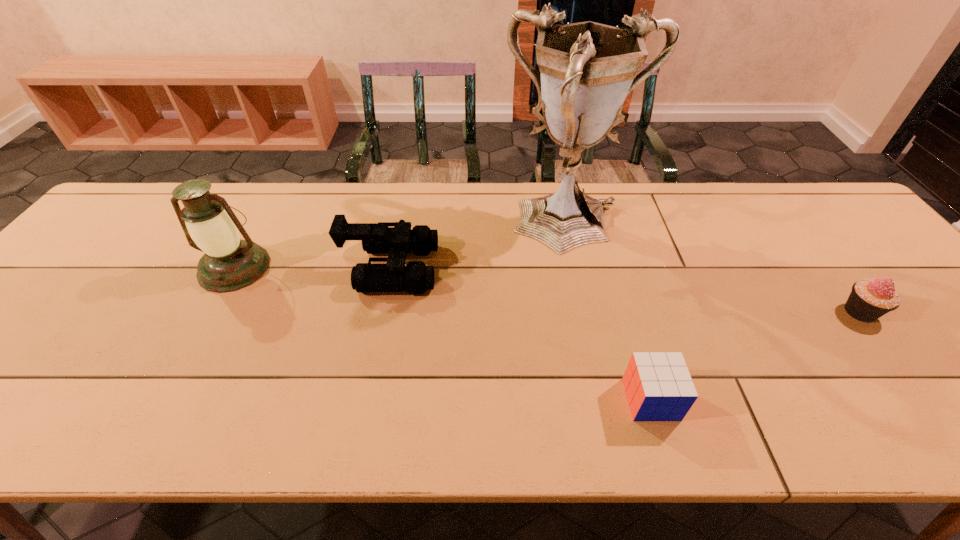
Identify the location of free spot between the tallest object and the cupcake. pyautogui.click(x=715, y=269).

This screenshot has width=960, height=540. I want to click on object that stands as the fourth closest to the trophy cup, so click(x=229, y=263).

You are a GUI agent. You are given a task and a screenshot of the screen. Output one action in this format:
    pyautogui.click(x=<x>, y=<y>)
    Task: Click on the object that ranks as the second closest to the lantern
    The height and width of the screenshot is (540, 960).
    Given the screenshot: What is the action you would take?
    pyautogui.click(x=588, y=69)

Locate an element on the screen. vacant space that satisfies the following two spatial constraints: 1. with the light compartment facing forward on the fourth tallest object; 2. on the right side of the lantern is located at coordinates (210, 312).

Find the location of `vacant position in the image that satisfies the following two spatial constraints: 1. on the front side of the trophy cup; 2. on the front lenses of the binoculars`. vacant position in the image that satisfies the following two spatial constraints: 1. on the front side of the trophy cup; 2. on the front lenses of the binoculars is located at coordinates (580, 268).

The width and height of the screenshot is (960, 540). Find the location of `vacant space that satisfies the following two spatial constraints: 1. on the back side of the cupcake; 2. on the left side of the shortest object`. vacant space that satisfies the following two spatial constraints: 1. on the back side of the cupcake; 2. on the left side of the shortest object is located at coordinates (625, 312).

I want to click on free space that satisfies the following two spatial constraints: 1. on the front lenses of the second object from left to right; 2. on the right side of the nearest object, so click(x=365, y=399).

The image size is (960, 540). Identify the location of free spot that satisfies the following two spatial constraints: 1. with the light compartment facing forward on the second tallest object; 2. on the left side of the nearest object. point(162,399).